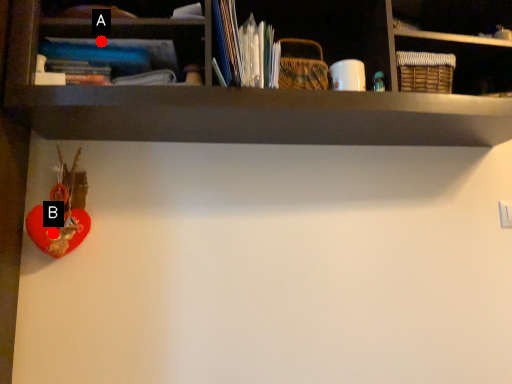
Question: Two points are circled on the image, labeled by A and B beside each circle. Which point is closer to the camera?

Choices:
 (A) A is closer
 (B) B is closer

Answer: (A)